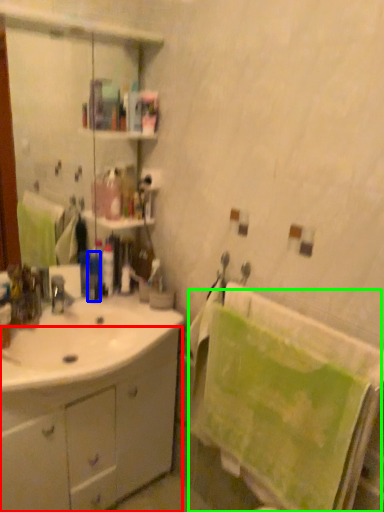
Question: Which object is positioned closest to bathroom cabinet (highlighted by a red box)? Select from toiletry (highlighted by a blue box) and bath towel (highlighted by a green box).

Choices:
 (A) toiletry
 (B) bath towel

Answer: (B)